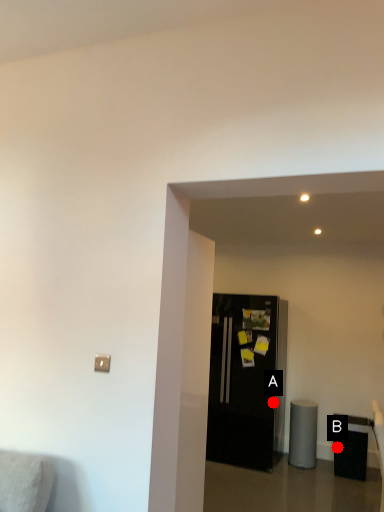
Question: Two points are circled on the image, labeled by A and B beside each circle. Which point is closer to the camera?

Choices:
 (A) A is closer
 (B) B is closer

Answer: (B)